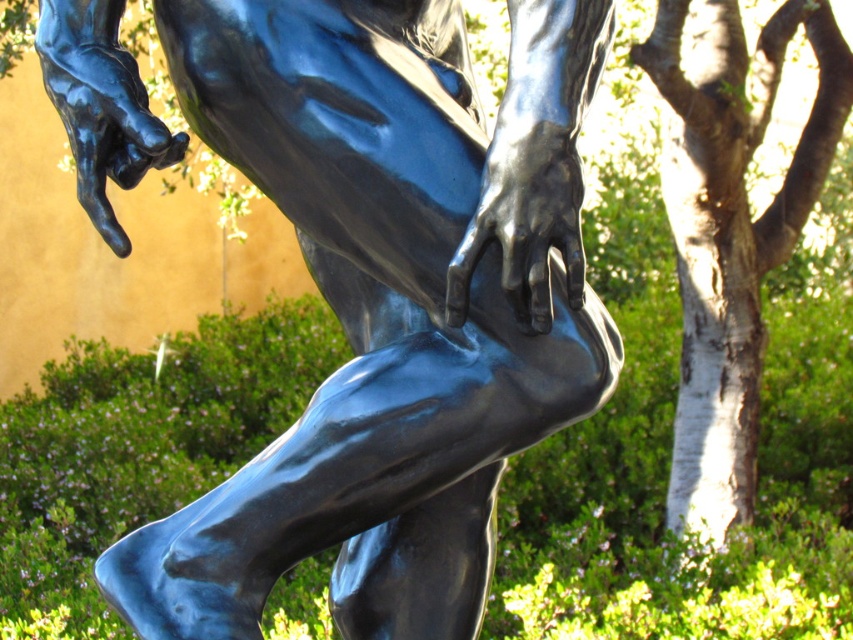
You are an art student who wants to sketch the scene. You need to know the relative positions of the glossy bronze statue at center and the white bark tree at right. Can you tell me which one is positioned lower in the image?

The glossy bronze statue at center is located below the white bark tree at right, so the statue is lower in the image.

You are standing in front of a bronze statue of an athlete. If you want to locate the glossy bronze statue at center, where should you look based on the coordinate system where the bottom left corner is the origin?

The glossy bronze statue at center is located at the coordinate point of 0.473 on the x axis and 0.456 on the y axis.

You are a painter standing 1.2 meters away from the glossy bronze statue at center. To paint the statue accurately, you need to be at least 1.2 meters away. Are you positioned correctly?

Yes, you are positioned correctly because the distance between you and the glossy bronze statue at center is exactly 1.21 meters, which meets the required minimum distance of 1.2 meters.